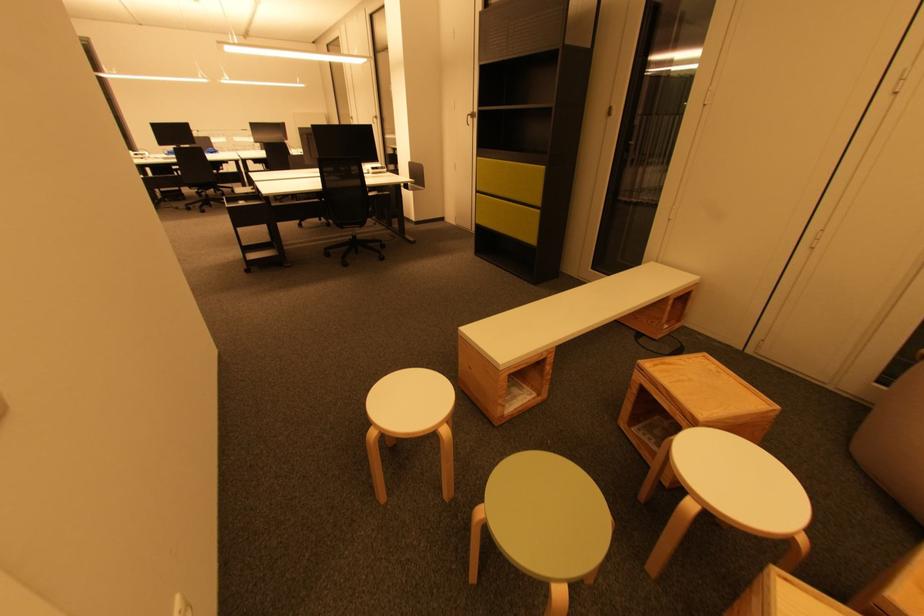
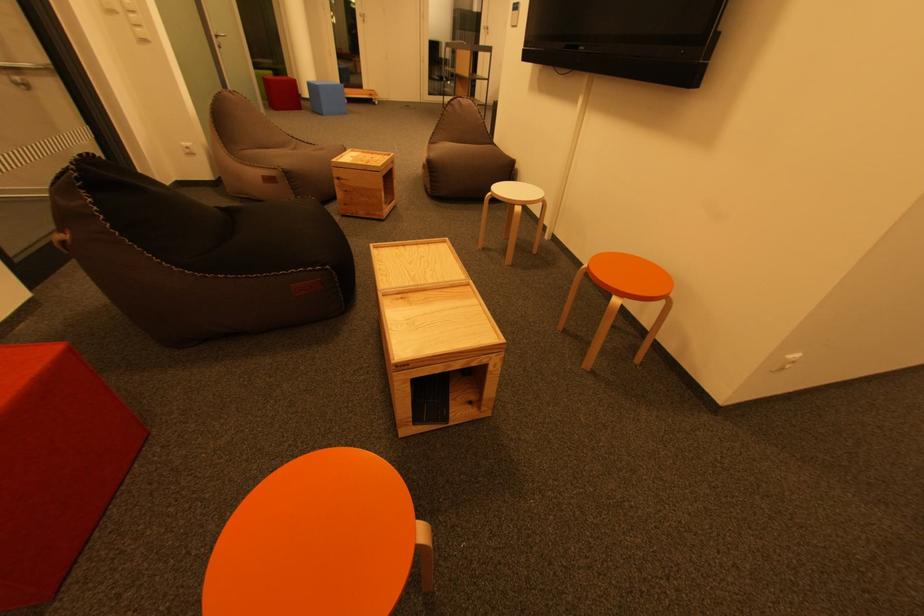
First-person continuous shooting, in which direction is the camera rotating?

The camera's rotation is toward left-down.